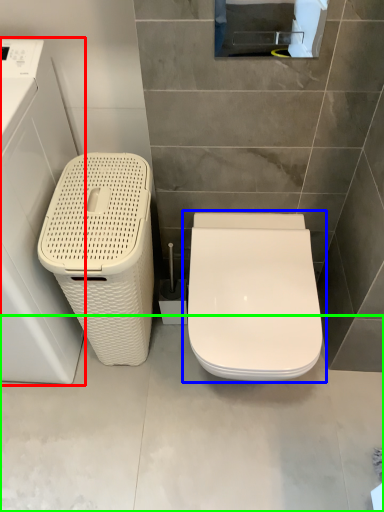
Question: Which object is the farthest from washing machine (highlighted by a red box)? Choose among these: toilet (highlighted by a blue box) or concrete (highlighted by a green box).

Choices:
 (A) toilet
 (B) concrete

Answer: (A)